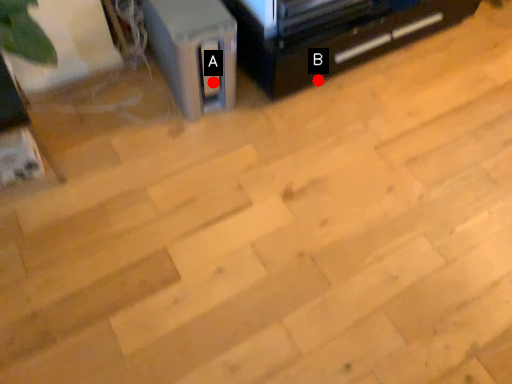
Question: Two points are circled on the image, labeled by A and B beside each circle. Which point appears farthest from the camera in this image?

Choices:
 (A) A is further
 (B) B is further

Answer: (B)